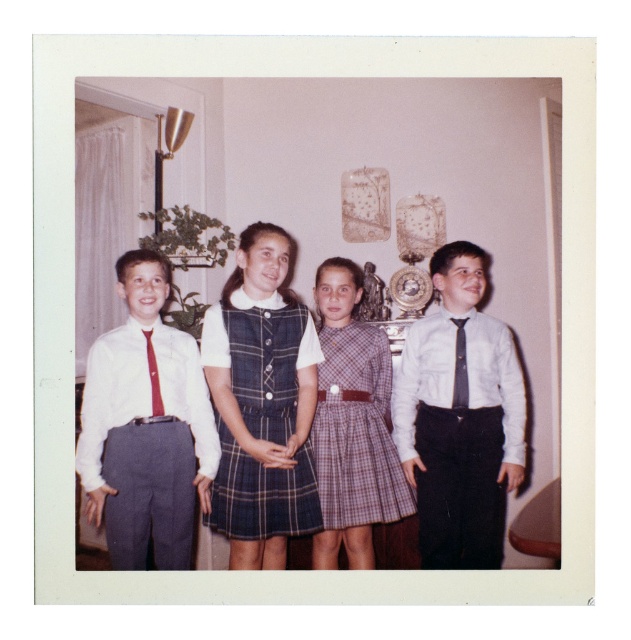
You are a photographer adjusting the lighting for the group photo. You notice the matte gray pants at left and the red satin tie at left. Which of these two items is closer to the floor?

The matte gray pants at left is positioned under the red satin tie at left, so the matte gray pants at left is closer to the floor.

You are a photographer adjusting the camera settings to ensure all children are in focus. The plaid wool dress at center and the plaid fabric dress at center are both in the frame. Which dress requires more space between the camera and the children to avoid blurring?

The plaid wool dress at center is wider than the plaid fabric dress at center, so it requires more space between the camera and the children to avoid blurring.

You are a photographer setting up for a family photo. You notice two items in the scene that need to be adjusted for symmetry. The matte white shirt at center and the red satin tie at left are slightly off. Which item should you adjust to make them more symmetrical in width?

The matte white shirt at center has a larger width than the red satin tie at left, so you should adjust the matte white shirt at center to reduce its width or adjust the red satin tie at left to increase its width for symmetry.